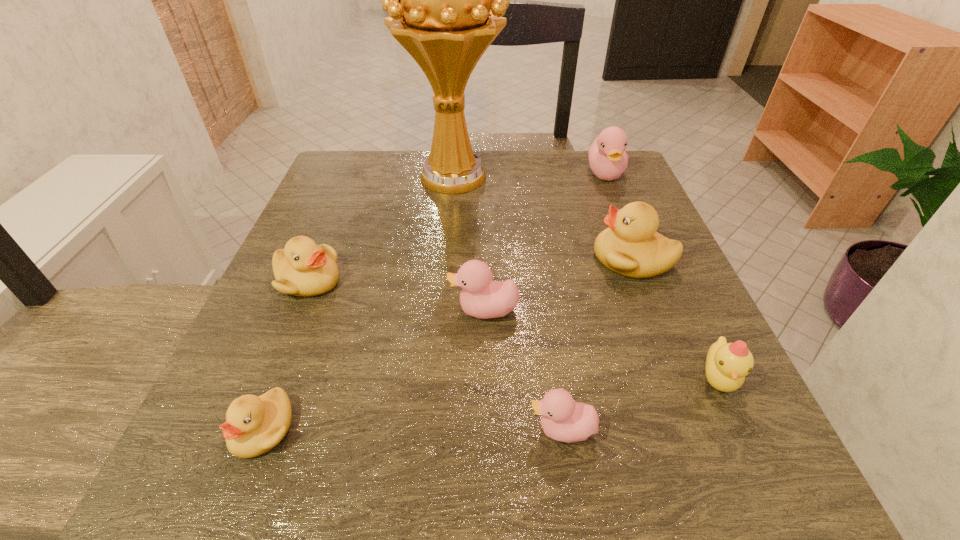
In order to click on pink duckling object that ranks as the closest to the nearest pink duckling in this screenshot , I will do `click(480, 297)`.

Find the location of a particular element. This screenshot has height=540, width=960. yellow duckling that is the fourth nearest to the farthest duckling is located at coordinates (254, 425).

Choose which yellow duckling is the third nearest neighbor to the biggest yellow duckling. Please provide its 2D coordinates. Your answer should be formatted as a tuple, i.e. [(x, y)], where the tuple contains the x and y coordinates of a point satisfying the conditions above.

[(254, 425)]